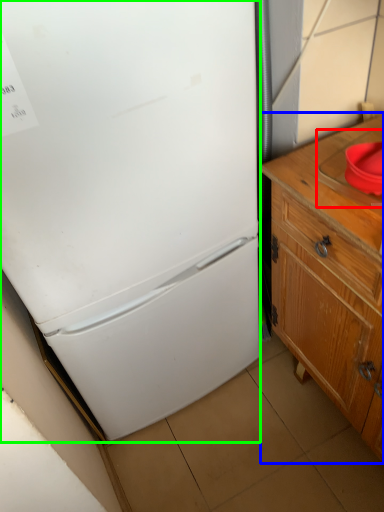
Question: Which object is positioned closest to sink (highlighted by a red box)? Select from cabinetry (highlighted by a blue box) and refrigerator (highlighted by a green box).

Choices:
 (A) cabinetry
 (B) refrigerator

Answer: (A)